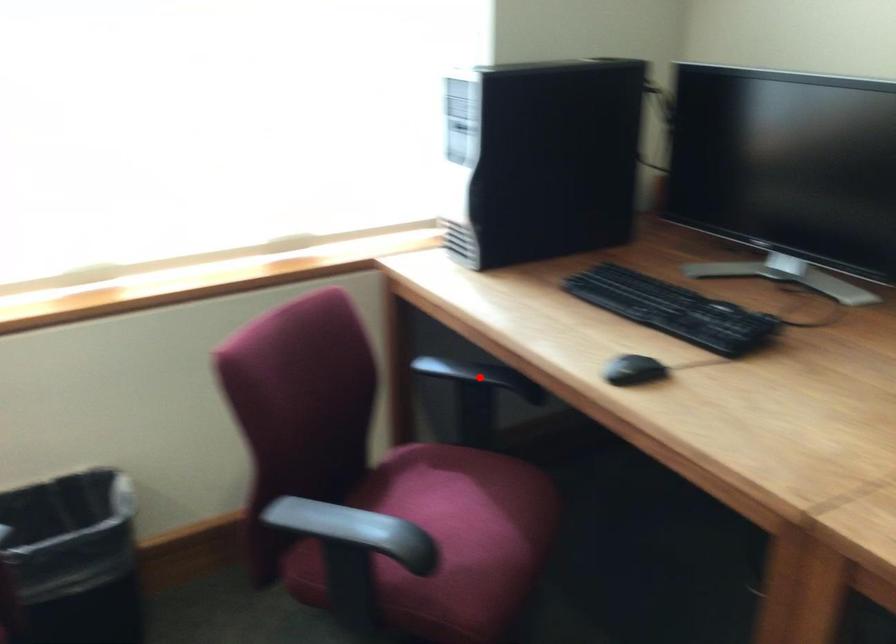
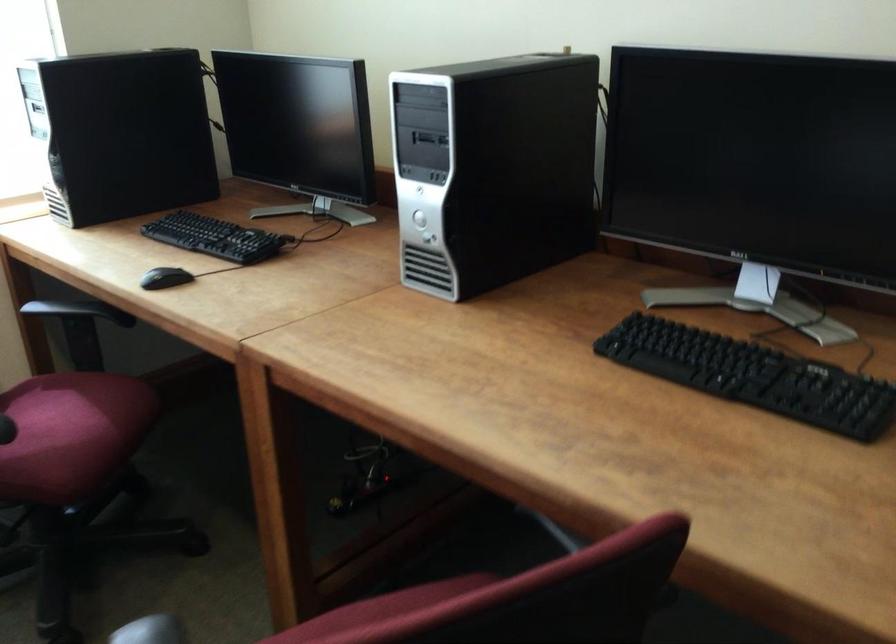
Question: A red point is marked in image1. In image2, is the corresponding 3D point closer to the camera or farther? Reply with the corresponding letter.

Choices:
 (A) The corresponding 3D point is closer.
 (B) The corresponding 3D point is farther.

Answer: (B)